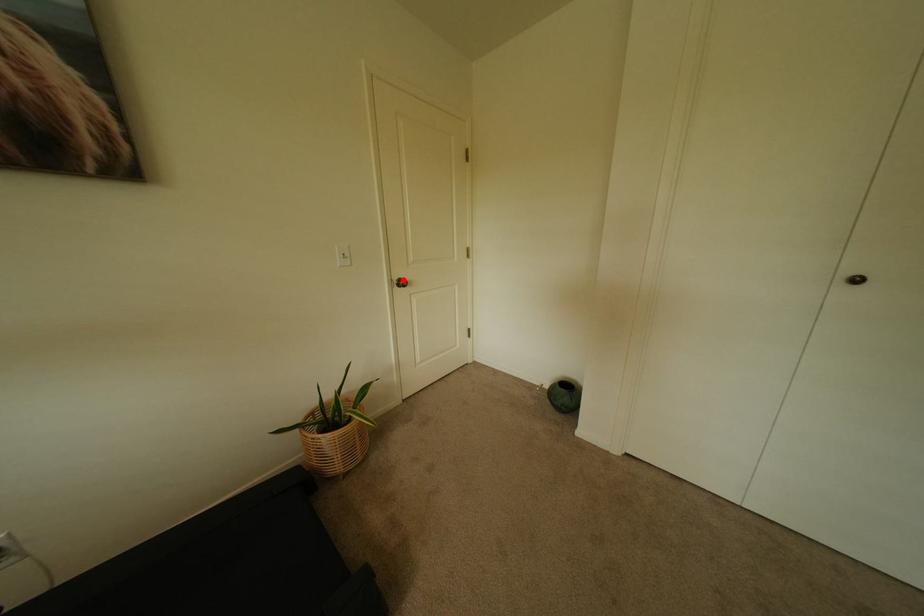
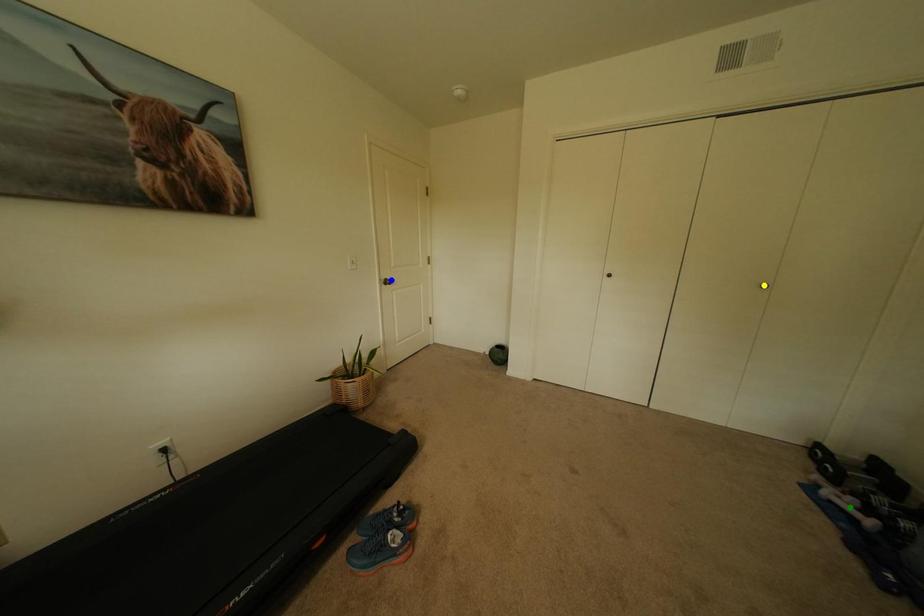
Question: I am providing you with two images of the same scene from different viewpoints. A red point is marked on the first image. You are given multiple points on the second image. Which mark in image 2 goes with the point in image 1?

Choices:
 (A) yellow point
 (B) green point
 (C) blue point

Answer: (C)